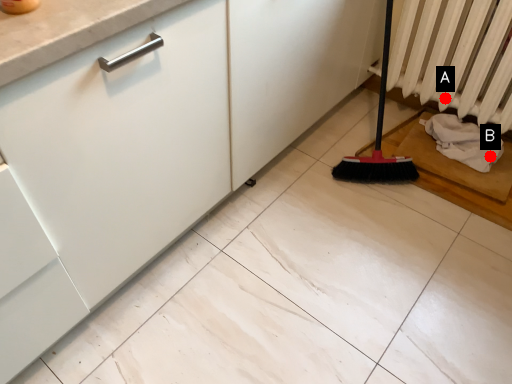
Question: Two points are circled on the image, labeled by A and B beside each circle. Among these points, which one is nearest to the camera?

Choices:
 (A) A is closer
 (B) B is closer

Answer: (B)